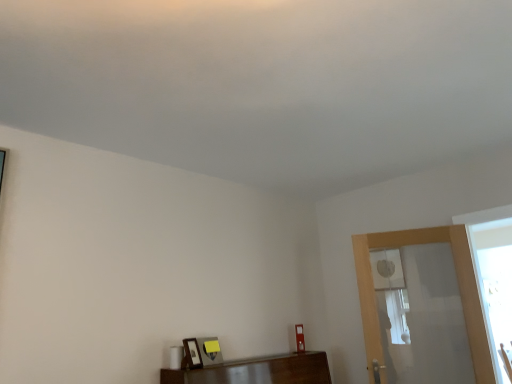
Describe the element at coordinates (458, 284) in the screenshot. This screenshot has width=512, height=384. I see `clear glass screen door at right` at that location.

Where is `clear glass screen door at right`? clear glass screen door at right is located at coordinates (458, 284).

Based on the photo, what is the approximate width of clear glass screen door at right?

clear glass screen door at right is 12.27 centimeters wide.

Where is `wooden picture frame at lower center`? wooden picture frame at lower center is located at coordinates (191, 354).

Describe the element at coordinates (191, 354) in the screenshot. I see `wooden picture frame at lower center` at that location.

Find the location of a particular element. clear glass screen door at right is located at coordinates (458, 284).

Can you confirm if clear glass screen door at right is positioned to the left of wooden picture frame at lower center?

No, clear glass screen door at right is not to the left of wooden picture frame at lower center.

Does clear glass screen door at right come behind wooden picture frame at lower center?

That is True.

Between point (485, 336) and point (186, 362), which one is positioned in front?

The point (186, 362) is closer to the camera.

From the image's perspective, is clear glass screen door at right located above or below wooden picture frame at lower center?

From the image's perspective, clear glass screen door at right appears above wooden picture frame at lower center.

From a real-world perspective, does clear glass screen door at right sit lower than wooden picture frame at lower center?

Incorrect, from a real-world perspective, clear glass screen door at right is higher than wooden picture frame at lower center.

Which of these two, clear glass screen door at right or wooden picture frame at lower center, is thinner?

With smaller width is wooden picture frame at lower center.

Does clear glass screen door at right have a lesser height compared to wooden picture frame at lower center?

In fact, clear glass screen door at right may be taller than wooden picture frame at lower center.

Based on their sizes in the image, would you say clear glass screen door at right is bigger or smaller than wooden picture frame at lower center?

Clearly, clear glass screen door at right is larger in size than wooden picture frame at lower center.

Would you say wooden picture frame at lower center is part of clear glass screen door at right's contents?

No, clear glass screen door at right does not contain wooden picture frame at lower center.

Is clear glass screen door at right placed right next to wooden picture frame at lower center?

No.

Is clear glass screen door at right looking in the opposite direction of wooden picture frame at lower center?

clear glass screen door at right does not have its back to wooden picture frame at lower center.

How different are the orientations of clear glass screen door at right and wooden picture frame at lower center in degrees?

There is a 80.8-degree angle between the facing directions of clear glass screen door at right and wooden picture frame at lower center.

The width and height of the screenshot is (512, 384). What are the coordinates of `screen door behind the wooden picture frame at lower center` in the screenshot? It's located at (458, 284).

Is wooden picture frame at lower center to the left of clear glass screen door at right from the viewer's perspective?

Correct, you'll find wooden picture frame at lower center to the left of clear glass screen door at right.

Which object is closer to the camera taking this photo, wooden picture frame at lower center or clear glass screen door at right?

wooden picture frame at lower center.

Which point is more forward, (193,345) or (382,370)?

Positioned in front is point (193,345).

From the image's perspective, who appears lower, wooden picture frame at lower center or clear glass screen door at right?

wooden picture frame at lower center, from the image's perspective.

From a real-world perspective, which is physically above, wooden picture frame at lower center or clear glass screen door at right?

In real-world perspective, clear glass screen door at right is above.

In the scene shown: Considering the relative sizes of wooden picture frame at lower center and clear glass screen door at right in the image provided, is wooden picture frame at lower center thinner than clear glass screen door at right?

Correct, the width of wooden picture frame at lower center is less than that of clear glass screen door at right.

Considering the relative sizes of wooden picture frame at lower center and clear glass screen door at right in the image provided, is wooden picture frame at lower center shorter than clear glass screen door at right?

Yes, wooden picture frame at lower center is shorter than clear glass screen door at right.

Which of these two, wooden picture frame at lower center or clear glass screen door at right, is bigger?

With larger size is clear glass screen door at right.

Can we say wooden picture frame at lower center lies outside clear glass screen door at right?

That's correct, wooden picture frame at lower center is outside of clear glass screen door at right.

Is wooden picture frame at lower center positioned far away from clear glass screen door at right?

Yes, wooden picture frame at lower center is far from clear glass screen door at right.

Looking at this image, is wooden picture frame at lower center turned away from clear glass screen door at right?

That's not correct — wooden picture frame at lower center is not looking away from clear glass screen door at right.

Where is `picture frame that is under the clear glass screen door at right (from a real-world perspective)`? The height and width of the screenshot is (384, 512). picture frame that is under the clear glass screen door at right (from a real-world perspective) is located at coordinates click(x=191, y=354).

Image resolution: width=512 pixels, height=384 pixels. Identify the location of picture frame in front of the clear glass screen door at right. (191, 354).

Find the location of `picture frame below the clear glass screen door at right (from the image's perspective)`. picture frame below the clear glass screen door at right (from the image's perspective) is located at coordinates (191, 354).